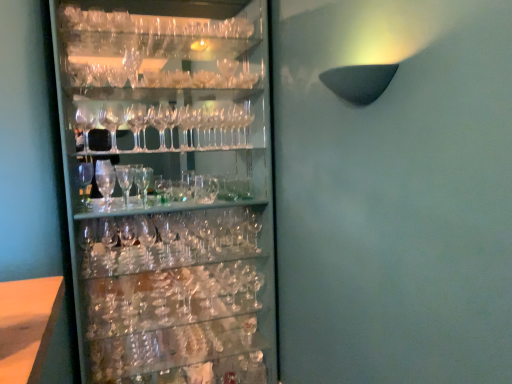
Question: Is clear glass beer glass at center positioned with its back to clear glass wine glasses at left?

Choices:
 (A) no
 (B) yes

Answer: (B)

Question: From a real-world perspective, is clear glass beer glass at center positioned under clear glass wine glasses at left based on gravity?

Choices:
 (A) no
 (B) yes

Answer: (A)

Question: Is clear glass beer glass at center positioned behind clear glass wine glasses at left?

Choices:
 (A) yes
 (B) no

Answer: (A)

Question: From the image's perspective, does clear glass beer glass at center appear higher than clear glass wine glasses at left?

Choices:
 (A) no
 (B) yes

Answer: (B)

Question: Is clear glass beer glass at center closer to camera compared to clear glass wine glasses at left?

Choices:
 (A) no
 (B) yes

Answer: (A)

Question: Is clear glass beer glass at center in front of or behind clear glass wine glass at upper center in the image?

Choices:
 (A) front
 (B) behind

Answer: (A)

Question: From the image's perspective, relative to clear glass wine glass at upper center, is clear glass beer glass at center above or below?

Choices:
 (A) below
 (B) above

Answer: (A)

Question: Is clear glass beer glass at center inside the boundaries of clear glass wine glass at upper center, or outside?

Choices:
 (A) outside
 (B) inside

Answer: (A)

Question: From a real-world perspective, is clear glass beer glass at center physically located above or below clear glass wine glass at upper center?

Choices:
 (A) above
 (B) below

Answer: (B)

Question: Would you say clear glass wine glass at upper center is to the left or to the right of clear glass beer glass at center in the picture?

Choices:
 (A) left
 (B) right

Answer: (B)

Question: From the image's perspective, is clear glass wine glass at upper center located above or below clear glass beer glass at center?

Choices:
 (A) below
 (B) above

Answer: (B)

Question: Does point (228, 77) appear closer or farther from the camera than point (135, 170)?

Choices:
 (A) closer
 (B) farther

Answer: (B)

Question: From their relative heights in the image, would you say clear glass wine glass at upper center is taller or shorter than clear glass beer glass at center?

Choices:
 (A) short
 (B) tall

Answer: (A)

Question: Visually, is clear glass wine glass at upper center positioned to the left or to the right of clear glass wine glasses at left?

Choices:
 (A) left
 (B) right

Answer: (B)

Question: Is clear glass wine glass at upper center wider or thinner than clear glass wine glasses at left?

Choices:
 (A) wide
 (B) thin

Answer: (B)